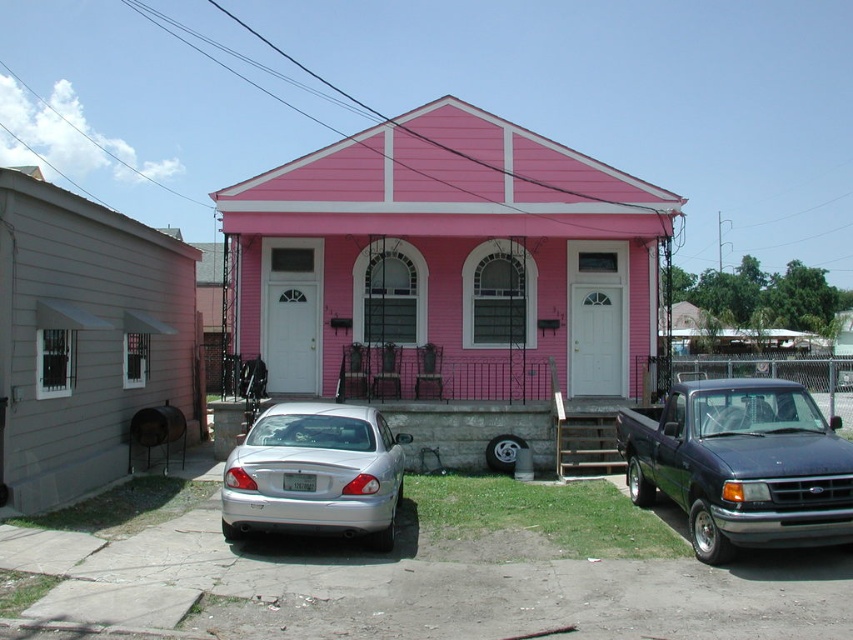
You are a delivery person trying to park your van in the driveway. The driveway has a metallic blue truck at right and a silver metallic sedan at lower center. Which vehicle should you move to make space?

The metallic blue truck at right is positioned over the silver metallic sedan at lower center, so you should move the metallic blue truck at right to create more space for your van.

You are a delivery person who needs to unload a package between the metallic blue truck at right and the silver metallic sedan at lower center. The package requires 10 feet of space to safely maneuver. Is there enough space between them?

The distance between the metallic blue truck at right and the silver metallic sedan at lower center is 11.46 feet, which is more than the required 10 feet. Therefore, there is enough space to safely maneuver the package between them.